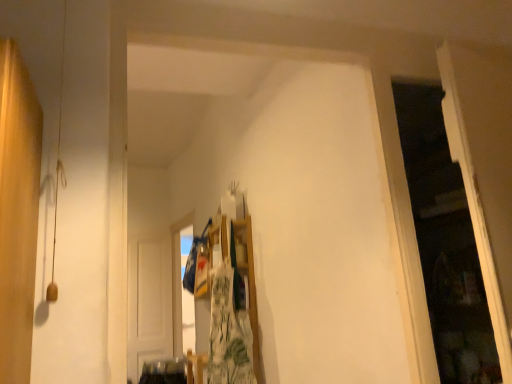
Question: Is transparent plastic window at upper center oriented towards white wooden door at center?

Choices:
 (A) yes
 (B) no

Answer: (A)

Question: Does transparent plastic window at upper center have a lesser width compared to white wooden door at center?

Choices:
 (A) yes
 (B) no

Answer: (B)

Question: Is transparent plastic window at upper center not inside white wooden door at center?

Choices:
 (A) no
 (B) yes

Answer: (B)

Question: Is transparent plastic window at upper center shorter than white wooden door at center?

Choices:
 (A) yes
 (B) no

Answer: (A)

Question: Is transparent plastic window at upper center positioned before white wooden door at center?

Choices:
 (A) yes
 (B) no

Answer: (A)

Question: From the image's perspective, is transparent plastic window at upper center above white wooden door at center?

Choices:
 (A) yes
 (B) no

Answer: (A)

Question: Considering the relative sizes of transparent plastic window at upper center and green floral fabric at center in the image provided, is transparent plastic window at upper center taller than green floral fabric at center?

Choices:
 (A) yes
 (B) no

Answer: (A)

Question: From a real-world perspective, is transparent plastic window at upper center below green floral fabric at center?

Choices:
 (A) yes
 (B) no

Answer: (B)

Question: Considering the relative positions of transparent plastic window at upper center and green floral fabric at center in the image provided, is transparent plastic window at upper center to the right of green floral fabric at center from the viewer's perspective?

Choices:
 (A) no
 (B) yes

Answer: (A)

Question: Is transparent plastic window at upper center oriented away from green floral fabric at center?

Choices:
 (A) no
 (B) yes

Answer: (A)

Question: Is transparent plastic window at upper center at the left side of green floral fabric at center?

Choices:
 (A) yes
 (B) no

Answer: (A)

Question: Is transparent plastic window at upper center shorter than green floral fabric at center?

Choices:
 (A) no
 (B) yes

Answer: (A)

Question: Is white wooden door at center far from transparent plastic window at upper center?

Choices:
 (A) no
 (B) yes

Answer: (A)